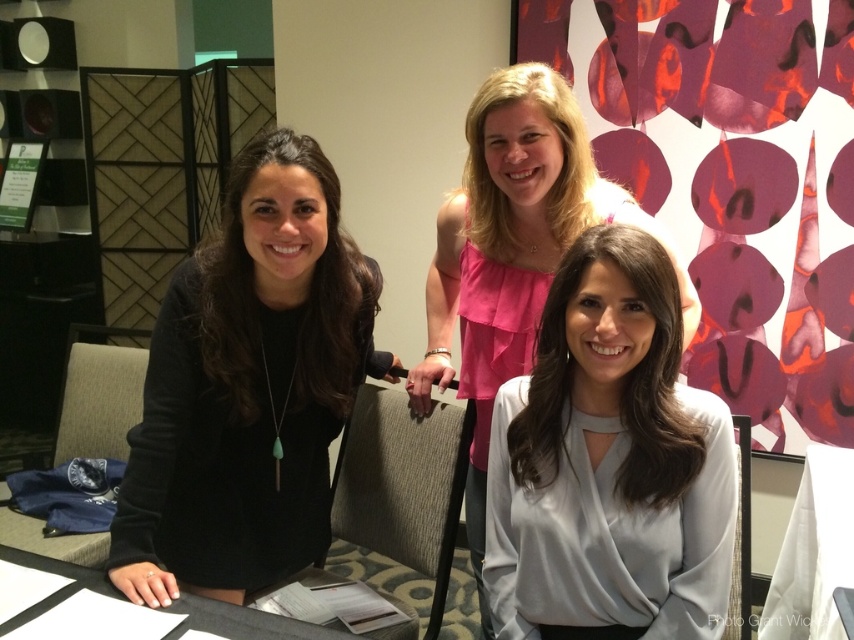
You are a photographer at a professional event and need to adjust the lighting to ensure both the satin white blouse at center and the pink satin blouse at center are evenly lit. Which blouse should you adjust the light towards to balance the exposure?

The satin white blouse at center is to the right of the pink satin blouse at center. Since white reflects more light, you should adjust the light towards the pink satin blouse at center to balance the exposure.

You are standing in the conference room and want to reach a point that is exactly 1.31 meters away from you. Can you confirm if the point at coordinates point [219,365] is exactly 1.31 meters away from your current position?

Yes, the point at coordinates point [219,365] is exactly 1.31 meters away from the viewer, so you can confirm that it meets the requirement.